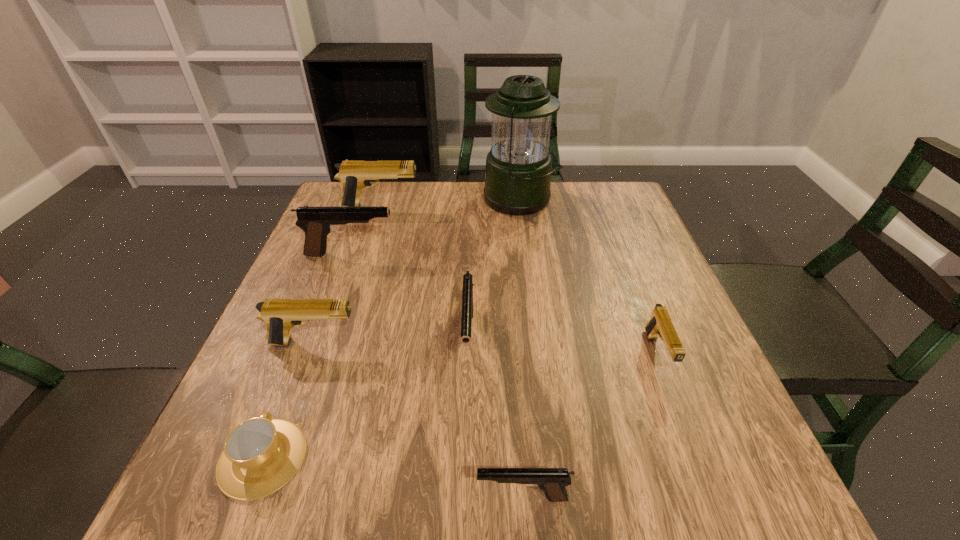
This screenshot has height=540, width=960. Find the location of `lantern`. lantern is located at coordinates (518, 172).

Identify the location of the tallest object. The image size is (960, 540). (518, 172).

Find the location of a particular element. the farthest tan pistol is located at coordinates (354, 175).

The width and height of the screenshot is (960, 540). I want to click on the biggest tan pistol, so click(x=354, y=175).

Where is `the leftmost black pistol`? Image resolution: width=960 pixels, height=540 pixels. the leftmost black pistol is located at coordinates (316, 222).

Locate an element on the screen. Image resolution: width=960 pixels, height=540 pixels. the farthest black pistol is located at coordinates (316, 222).

The image size is (960, 540). In order to click on the second smallest tan pistol in this screenshot , I will do `click(280, 315)`.

Identify the location of the second black pistol from right to left. (467, 292).

Identify the location of the second biggest black pistol. (467, 292).

I want to click on the rightmost tan pistol, so click(x=660, y=325).